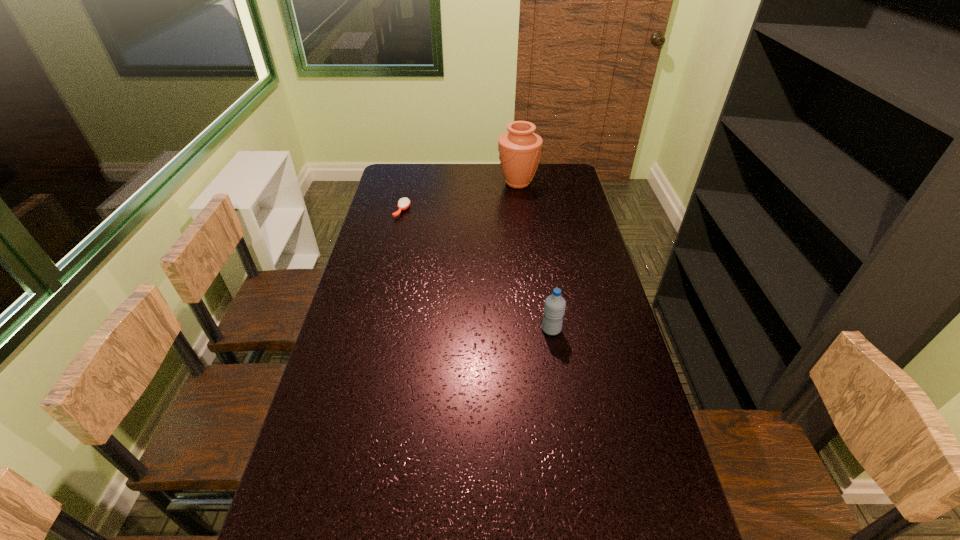
What are the coordinates of `object located at the left edge` in the screenshot? It's located at (403, 203).

At what (x,y) coordinates should I click in order to perform the action: click on vacant space at the left edge of the desktop. Please return your answer as a coordinate pair (x, y). Looking at the image, I should click on (352, 492).

What are the coordinates of `vacant region at the right edge of the desktop` in the screenshot? It's located at (563, 203).

The height and width of the screenshot is (540, 960). I want to click on blank area at the far left corner, so click(x=420, y=182).

This screenshot has width=960, height=540. I want to click on blank region between the water bottle and the second nearest object, so click(477, 270).

At what (x,y) coordinates should I click in order to perform the action: click on free space between the farthest object and the hairbrush. Please return your answer as a coordinate pair (x, y). This screenshot has width=960, height=540. Looking at the image, I should click on (460, 197).

Where is `vacant point located between the vase and the second nearest object`? vacant point located between the vase and the second nearest object is located at coordinates (460, 197).

Find the location of `object that is the closest to the hairbrush`. object that is the closest to the hairbrush is located at coordinates (519, 149).

Identify which object is the closest to the shortest object. Please provide its 2D coordinates. Your answer should be formatted as a tuple, i.e. [(x, y)], where the tuple contains the x and y coordinates of a point satisfying the conditions above.

[(519, 149)]

Image resolution: width=960 pixels, height=540 pixels. I want to click on vacant area that satisfies the following two spatial constraints: 1. on the front side of the farthest object; 2. on the right side of the nearest object, so click(536, 329).